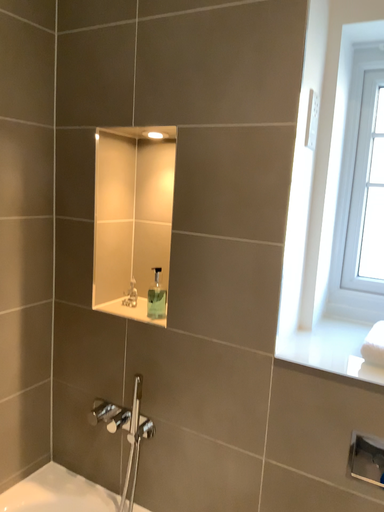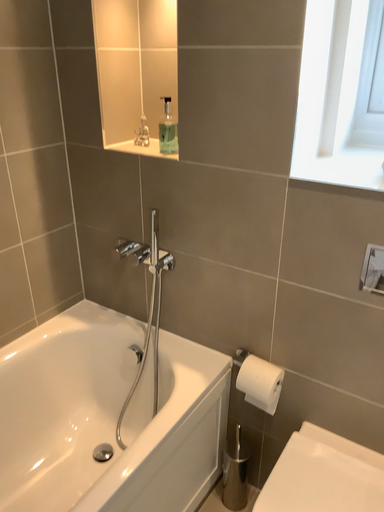
Question: Which way did the camera rotate in the video?

Choices:
 (A) rotated upward
 (B) rotated downward

Answer: (B)